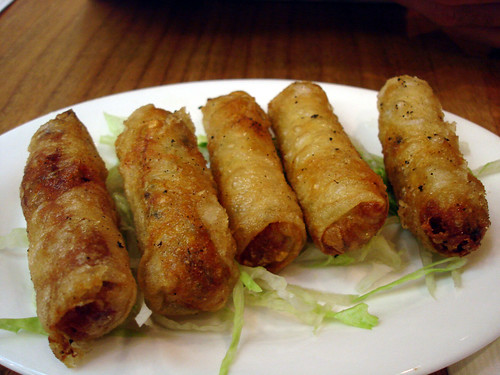
What are the coordinates of `counter/table wooden` in the screenshot? It's located at (129, 48).